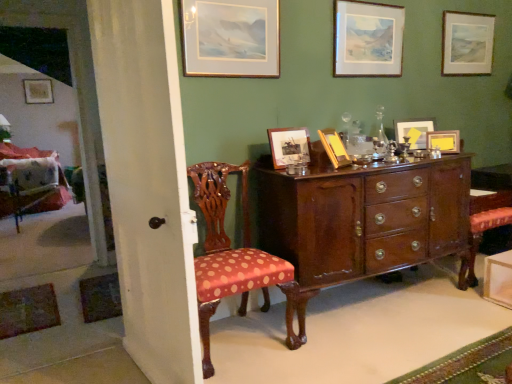
In order to click on vacant space underneath polka dot fabric chair at left, which appears as the second chair when viewed from the left (from a real-world perspective) in this screenshot , I will do `click(239, 339)`.